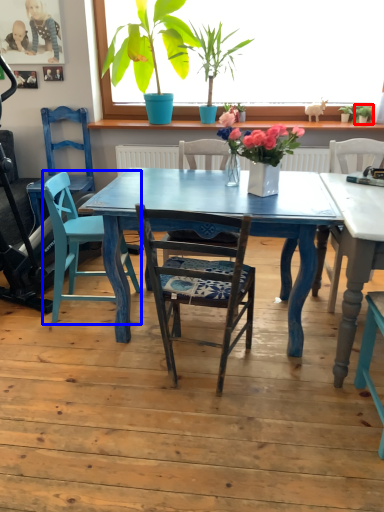
Question: Which of the following is the farthest to the observer, houseplant (highlighted by a red box) or swivel chair (highlighted by a blue box)?

Choices:
 (A) houseplant
 (B) swivel chair

Answer: (A)